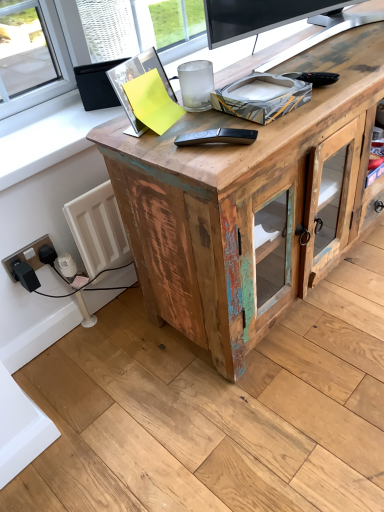
You are a GUI agent. You are given a task and a screenshot of the screen. Output one action in this format:
    pyautogui.click(x=<x>, y=<y>)
    Task: Click on the free region on the left part of black plastic remote control at center
    Image resolution: width=384 pixels, height=512 pixels.
    Given the screenshot: What is the action you would take?
    pyautogui.click(x=156, y=144)